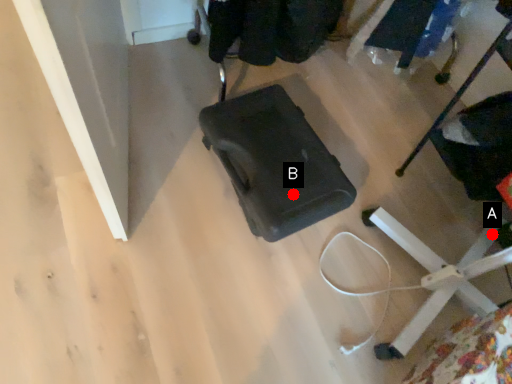
Question: Two points are circled on the image, labeled by A and B beside each circle. Which point is closer to the camera?

Choices:
 (A) A is closer
 (B) B is closer

Answer: (B)